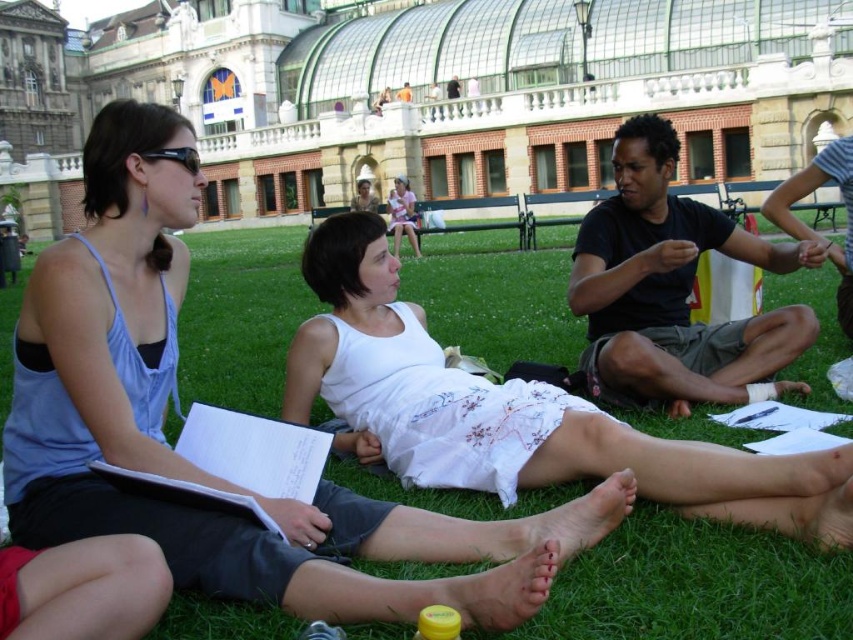
Is point (776, 352) behind point (822, 170)?

No, (776, 352) is in front of (822, 170).

Who is positioned more to the right, black matte shirt at center or dark brown leather jacket at right?

dark brown leather jacket at right is more to the right.

Is point (627, 225) positioned before point (790, 177)?

Yes.

Find the location of a particular element. black matte shirt at center is located at coordinates (674, 291).

Is point (804, 196) positioned in front of point (610, 518)?

No, (804, 196) is behind (610, 518).

Identify the location of dark brown leather jacket at right. This screenshot has width=853, height=640. (811, 228).

Find the location of `dark brown leather jacket at right`. dark brown leather jacket at right is located at coordinates (811, 228).

How far apart are matte blue tank top at left and white cotton dress at center?

They are 23.48 feet apart.

Which is below, matte blue tank top at left or white cotton dress at center?

matte blue tank top at left is lower down.

Is point (283, 566) farther from viewer compared to point (421, 385)?

No, (283, 566) is closer to viewer.

I want to click on matte blue tank top at left, so click(166, 406).